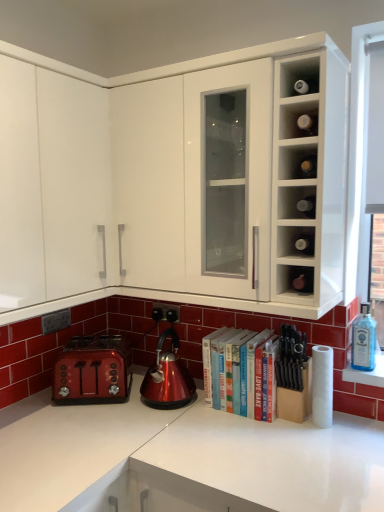
The width and height of the screenshot is (384, 512). I want to click on matte glass wine bottle at center-right, acting as the 2th cabinet starting from the top, so click(295, 241).

Locate an element on the screen. white matte cabinet at upper left, which ranks as the 1th cabinetry in left-to-right order is located at coordinates (52, 185).

This screenshot has height=512, width=384. Describe the element at coordinates (295, 281) in the screenshot. I see `matte brown bottle at lower right, which is counted as the first cabinet, starting from the bottom` at that location.

Where is `matte glass wine bottle at center-right, acting as the 2th cabinet starting from the top`? This screenshot has height=512, width=384. matte glass wine bottle at center-right, acting as the 2th cabinet starting from the top is located at coordinates (295, 241).

From a real-world perspective, between matte black electric outlet at lower left, positioned as the 1th electric outlet in left-to-right order, and matte brown bottle at lower right, the third cabinet from the top, who is vertically lower?

From a 3D spatial view, matte black electric outlet at lower left, positioned as the 1th electric outlet in left-to-right order, is below.

Consider the image. Can you tell me how much matte black electric outlet at lower left, marked as the 2th electric outlet in a back-to-front arrangement, and matte brown bottle at lower right, the third cabinet from the top, differ in facing direction?

The angle between the facing direction of matte black electric outlet at lower left, marked as the 2th electric outlet in a back-to-front arrangement, and the facing direction of matte brown bottle at lower right, the third cabinet from the top, is 90 degrees.

Who is smaller, matte black electric outlet at lower left, marked as the 2th electric outlet in a back-to-front arrangement, or matte brown bottle at lower right, which is counted as the first cabinet, starting from the bottom?

matte black electric outlet at lower left, marked as the 2th electric outlet in a back-to-front arrangement, is smaller.

Does white matte paper towel at lower right have a lesser width compared to glossy metallic kettle at center?

Correct, the width of white matte paper towel at lower right is less than that of glossy metallic kettle at center.

What's the angular difference between white matte paper towel at lower right and glossy metallic kettle at center's facing directions?

4.76 degrees separate the facing orientations of white matte paper towel at lower right and glossy metallic kettle at center.

Where is `kettle on the left of white matte paper towel at lower right`? kettle on the left of white matte paper towel at lower right is located at coordinates (168, 377).

Considering the positions of points (42, 319) and (172, 315), is point (42, 319) farther from camera compared to point (172, 315)?

No, (42, 319) is in front of (172, 315).

Does matte black electric outlet at lower left, marked as the 2th electric outlet in a right-to-left arrangement, have a greater width compared to black plastic electric outlet at lower center, the second electric outlet in the left-to-right sequence?

In fact, matte black electric outlet at lower left, marked as the 2th electric outlet in a right-to-left arrangement, might be narrower than black plastic electric outlet at lower center, the second electric outlet in the left-to-right sequence.

Looking at this image, who is more distant, matte black electric outlet at lower left, marked as the 2th electric outlet in a back-to-front arrangement, or black plastic electric outlet at lower center, which ranks as the 1th electric outlet in back-to-front order?

black plastic electric outlet at lower center, which ranks as the 1th electric outlet in back-to-front order, is more distant.

From the image's perspective, relative to black plastic electric outlet at lower center, acting as the second electric outlet starting from the front, is matte black electric outlet at lower left, marked as the 2th electric outlet in a right-to-left arrangement, above or below?

matte black electric outlet at lower left, marked as the 2th electric outlet in a right-to-left arrangement, is below black plastic electric outlet at lower center, acting as the second electric outlet starting from the front.

From the image's perspective, would you say matte brown bottle at lower right, which is counted as the first cabinet, starting from the bottom, is shown under matte glass wine bottles at upper right, marked as the 3th cabinet in a bottom-to-top arrangement?

Yes, from the image's perspective, matte brown bottle at lower right, which is counted as the first cabinet, starting from the bottom, is beneath matte glass wine bottles at upper right, marked as the 3th cabinet in a bottom-to-top arrangement.

Is matte brown bottle at lower right, which is counted as the first cabinet, starting from the bottom, to the left or to the right of matte glass wine bottles at upper right, which ranks as the 1th cabinet in top-to-bottom order, in the image?

Based on their positions, matte brown bottle at lower right, which is counted as the first cabinet, starting from the bottom, is located to the right of matte glass wine bottles at upper right, which ranks as the 1th cabinet in top-to-bottom order.

Is matte brown bottle at lower right, the third cabinet from the top, facing away from matte glass wine bottles at upper right, which ranks as the 1th cabinet in top-to-bottom order?

That's not correct — matte brown bottle at lower right, the third cabinet from the top, is not looking away from matte glass wine bottles at upper right, which ranks as the 1th cabinet in top-to-bottom order.

Does point (289, 279) come closer to viewer compared to point (283, 138)?

No, it is behind (283, 138).

Considering the sizes of objects black plastic electric outlet at lower center, acting as the second electric outlet starting from the front, and hardcover books at center in the image provided, who is wider, black plastic electric outlet at lower center, acting as the second electric outlet starting from the front, or hardcover books at center?

Wider between the two is hardcover books at center.

Is black plastic electric outlet at lower center, which is counted as the 1th electric outlet, starting from the right, further to the viewer compared to hardcover books at center?

Yes, the depth of black plastic electric outlet at lower center, which is counted as the 1th electric outlet, starting from the right, is greater than that of hardcover books at center.

Consider the image. Considering the positions of objects black plastic electric outlet at lower center, acting as the second electric outlet starting from the front, and hardcover books at center in the image provided, who is more to the right, black plastic electric outlet at lower center, acting as the second electric outlet starting from the front, or hardcover books at center?

hardcover books at center.

From the image's perspective, is black plastic electric outlet at lower center, acting as the second electric outlet starting from the front, below hardcover books at center?

No, from the image's perspective, black plastic electric outlet at lower center, acting as the second electric outlet starting from the front, is not below hardcover books at center.

Can you see shiny metallic toaster at lower left touching white matte cabinet at upper left, which ranks as the 1th cabinetry in left-to-right order?

shiny metallic toaster at lower left and white matte cabinet at upper left, which ranks as the 1th cabinetry in left-to-right order, are clearly separated.

Does shiny metallic toaster at lower left contain white matte cabinet at upper left, which is the 2th cabinetry from right to left?

Definitely not — white matte cabinet at upper left, which is the 2th cabinetry from right to left, is not inside shiny metallic toaster at lower left.

Consider the image. Between shiny metallic toaster at lower left and white matte cabinet at upper left, which is the 2th cabinetry from right to left, which one is positioned in front?

Positioned in front is white matte cabinet at upper left, which is the 2th cabinetry from right to left.

Is shiny metallic toaster at lower left oriented away from white matte cabinet at upper left, which is the 2th cabinetry from right to left?

No, white matte cabinet at upper left, which is the 2th cabinetry from right to left, is not at the back of shiny metallic toaster at lower left.

From a real-world perspective, which object rests below the other?

black plastic electric outlet at lower center, the second electric outlet in the left-to-right sequence.

Looking at this image, does matte glass wine bottles at upper right, which ranks as the 1th cabinet in top-to-bottom order, have a lesser height compared to black plastic electric outlet at lower center, acting as the second electric outlet starting from the front?

Indeed, matte glass wine bottles at upper right, which ranks as the 1th cabinet in top-to-bottom order, has a lesser height compared to black plastic electric outlet at lower center, acting as the second electric outlet starting from the front.

Is matte glass wine bottles at upper right, marked as the 3th cabinet in a bottom-to-top arrangement, to the left or to the right of black plastic electric outlet at lower center, which is counted as the 1th electric outlet, starting from the right, in the image?

Clearly, matte glass wine bottles at upper right, marked as the 3th cabinet in a bottom-to-top arrangement, is on the right of black plastic electric outlet at lower center, which is counted as the 1th electric outlet, starting from the right, in the image.

Looking at this image, measure the distance from matte glass wine bottles at upper right, which ranks as the 1th cabinet in top-to-bottom order, to black plastic electric outlet at lower center, which ranks as the 1th electric outlet in back-to-front order.

A distance of 35.60 inches exists between matte glass wine bottles at upper right, which ranks as the 1th cabinet in top-to-bottom order, and black plastic electric outlet at lower center, which ranks as the 1th electric outlet in back-to-front order.

From the image's perspective, count 1st cabinets upward from the matte black electric outlet at lower left, marked as the 2th electric outlet in a right-to-left arrangement, and point to it. Please provide its 2D coordinates.

[(295, 281)]

Where is `paper towel in front of the glossy metallic kettle at center`? The width and height of the screenshot is (384, 512). paper towel in front of the glossy metallic kettle at center is located at coordinates (322, 386).

Considering their positions, is matte brown bottle at lower right, the third cabinet from the top, positioned further to hardcover books at center than white matte paper towel at lower right?

matte brown bottle at lower right, the third cabinet from the top, is further to hardcover books at center.

Based on their spatial positions, is white glossy cabinet at upper center, the 1th cabinetry when ordered from right to left, or glossy metallic kettle at center further from matte glass wine bottle at center-right, acting as the 2th cabinet starting from the top?

The object further to matte glass wine bottle at center-right, acting as the 2th cabinet starting from the top, is glossy metallic kettle at center.

Which object lies nearer to the anchor point glossy metallic kettle at center, white matte paper towel at lower right or hardcover books at center?

hardcover books at center.

Looking at the image, which one is located further to white matte paper towel at lower right, matte brown bottle at lower right, which is counted as the first cabinet, starting from the bottom, or hardcover books at center?

matte brown bottle at lower right, which is counted as the first cabinet, starting from the bottom, is positioned further to the anchor white matte paper towel at lower right.

Estimate the real-world distances between objects in this image. Which object is further from matte black electric outlet at lower left, placed as the 1th electric outlet when sorted from front to back, white matte cabinet at upper left, which is the 2th cabinetry from right to left, or white glossy cabinet at upper center, the 1th cabinetry when ordered from right to left?

white glossy cabinet at upper center, the 1th cabinetry when ordered from right to left, is positioned further to the anchor matte black electric outlet at lower left, placed as the 1th electric outlet when sorted from front to back.

Based on the photo, looking at the image, which one is located closer to blue glass bottle at right, matte black electric outlet at lower left, positioned as the 1th electric outlet in left-to-right order, or white matte cabinet at upper left, which ranks as the 1th cabinetry in left-to-right order?

Based on the image, white matte cabinet at upper left, which ranks as the 1th cabinetry in left-to-right order, appears to be nearer to blue glass bottle at right.

Based on their spatial positions, is shiny metallic toaster at lower left or matte glass wine bottles at upper right, marked as the 3th cabinet in a bottom-to-top arrangement, closer to blue glass bottle at right?

matte glass wine bottles at upper right, marked as the 3th cabinet in a bottom-to-top arrangement, lies closer to blue glass bottle at right than the other object.

Which object lies nearer to the anchor point matte glass wine bottles at upper right, marked as the 3th cabinet in a bottom-to-top arrangement, white matte cabinet at upper left, which ranks as the 1th cabinetry in left-to-right order, or hardcover books at center?

white matte cabinet at upper left, which ranks as the 1th cabinetry in left-to-right order, is positioned closer to the anchor matte glass wine bottles at upper right, marked as the 3th cabinet in a bottom-to-top arrangement.

Locate an element on the screen. toaster located between white matte cabinet at upper left, which ranks as the 1th cabinetry in left-to-right order, and blue glass bottle at right in the left-right direction is located at coordinates (93, 371).

The height and width of the screenshot is (512, 384). What are the coordinates of `book between matte brown bottle at lower right, which is counted as the first cabinet, starting from the bottom, and black plastic electric outlet at lower center, which is counted as the 1th electric outlet, starting from the right, from front to back` in the screenshot? It's located at (271, 375).

What are the coordinates of `kettle between shiny metallic toaster at lower left and matte glass wine bottle at center-right, acting as the 2th cabinet starting from the top, from left to right` in the screenshot? It's located at (168, 377).

I want to click on book between matte glass wine bottle at center-right, acting as the 2th cabinet starting from the top, and white matte paper towel at lower right from top to bottom, so click(271, 375).